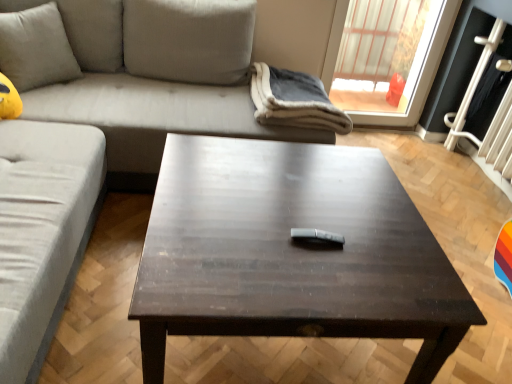
You are a GUI agent. You are given a task and a screenshot of the screen. Output one action in this format:
    pyautogui.click(x=<x>, y=<y>)
    Task: Click on the vacant area in front of satin silver remote at center
    
    Given the screenshot: What is the action you would take?
    pyautogui.click(x=321, y=279)